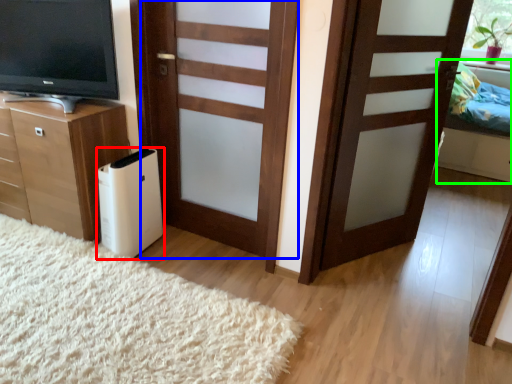
Question: Which object is positioned farthest from appliance (highlighted by a red box)? Select from door (highlighted by a blue box) and bed (highlighted by a green box).

Choices:
 (A) door
 (B) bed

Answer: (B)